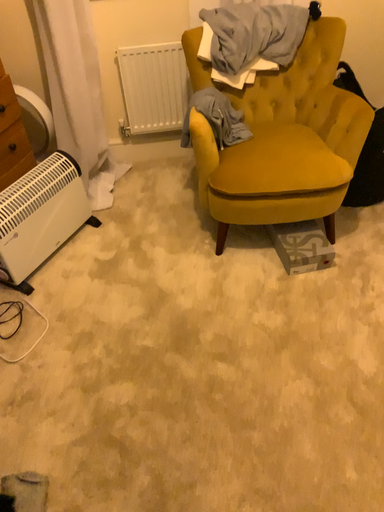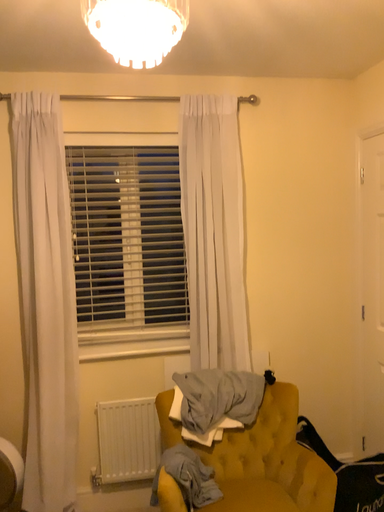
Question: Which way did the camera rotate in the video?

Choices:
 (A) rotated upward
 (B) rotated downward

Answer: (A)